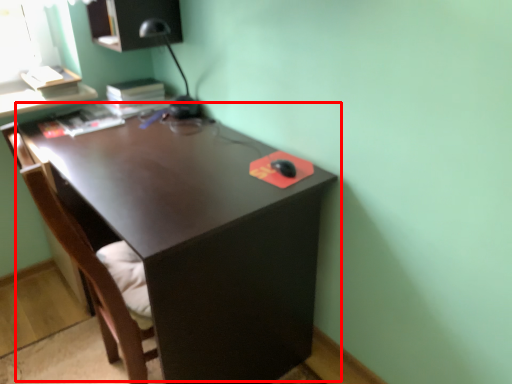
Question: From the image's perspective, where is desk (annotated by the red box) located in relation to swivel chair in the image?

Choices:
 (A) below
 (B) above

Answer: (B)